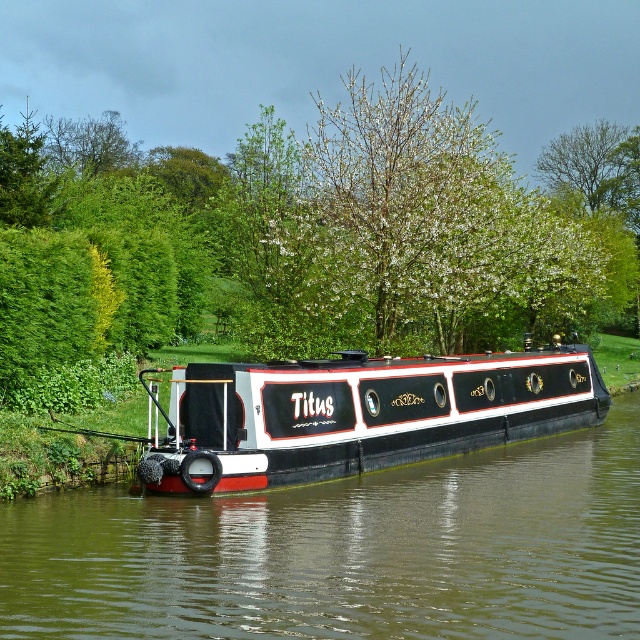
You are standing on the dock next to the narrowboat Titus. You want to take a photo of the green leafy tree at center. Where should you position yourself to ensure the tree is centered in your photo?

To center the green leafy tree at center in your photo, position yourself at the coordinates provided by the point mentioned in the description, which is at point (323,232).

You are standing on the deck of the narrowboat Titus and see two points marked on the canal. The first point is at coordinates point [104,508] and the second point is at point [577,125]. From your position on the boat, which point is closer to you?

Point [104,508] is in front of point [577,125], so from your position on the boat, point [104,508] is closer to you.

From the picture: You are standing on the dock next to the canal. You see the green leafy tree at center and the black polished wood barge at center. Which object is positioned higher in the image?

The green leafy tree at center is located above the black polished wood barge at center, so it is positioned higher in the image.